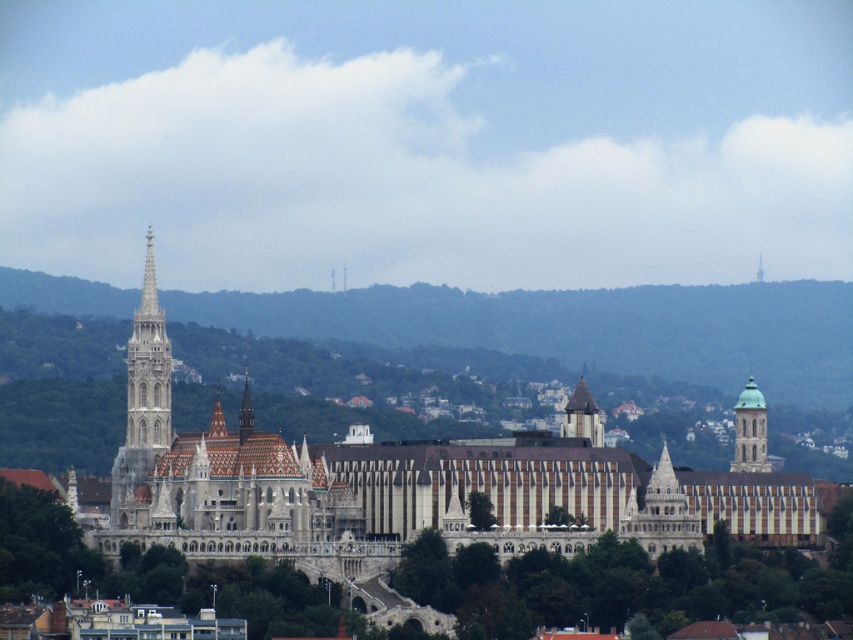
Question: Does white stone palace at center have a larger size compared to white stone tower at left?

Choices:
 (A) no
 (B) yes

Answer: (B)

Question: Is green glass tower at upper right below smooth stone spire at center?

Choices:
 (A) yes
 (B) no

Answer: (A)

Question: Which point appears closest to the camera in this image?

Choices:
 (A) (370, 522)
 (B) (245, 397)

Answer: (B)

Question: Is white stone tower at left bigger than green glass tower at upper right?

Choices:
 (A) no
 (B) yes

Answer: (B)

Question: Which of the following is the farthest from the observer?

Choices:
 (A) (245, 424)
 (B) (136, 464)
 (C) (764, 408)

Answer: (C)

Question: Which object is the closest to the green glass tower at upper right?

Choices:
 (A) white stone tower at left
 (B) smooth stone tower at center

Answer: (B)